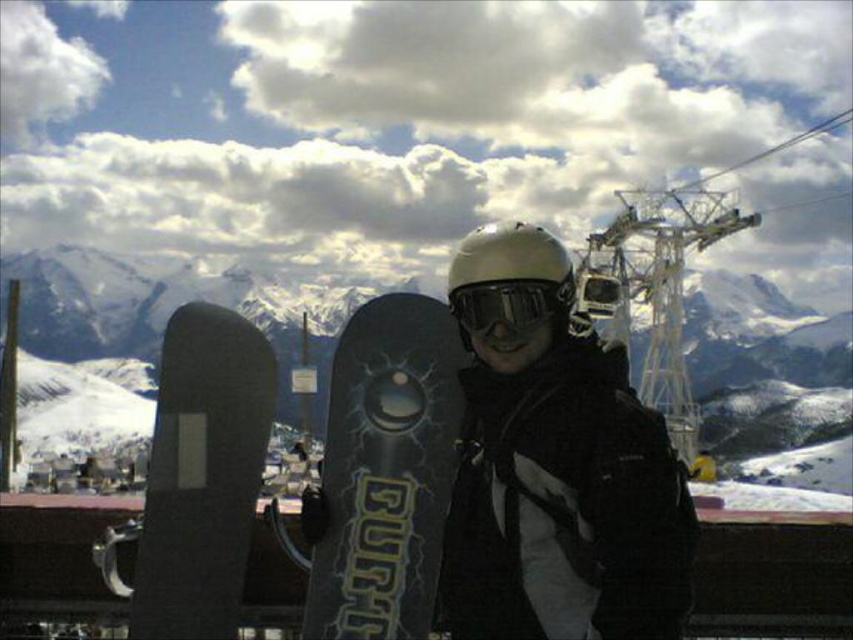
Question: From the image, what is the correct spatial relationship of snowy mountain at center in relation to glossy plastic goggles at center?

Choices:
 (A) left
 (B) right

Answer: (A)

Question: Among these points, which one is nearest to the camera?

Choices:
 (A) (766, 438)
 (B) (422, 378)
 (C) (173, 509)

Answer: (C)

Question: Estimate the real-world distances between objects in this image. Which object is closer to the black matte snowboard at left?

Choices:
 (A) black matte snowboard at center
 (B) white matte helmet at center
 (C) glossy plastic goggles at center
 (D) snowy mountain at center

Answer: (A)

Question: In this image, where is snowy mountain at center located relative to black matte snowboard at center?

Choices:
 (A) above
 (B) below

Answer: (A)

Question: Which of the following is the farthest from the observer?

Choices:
 (A) glossy plastic goggles at center
 (B) snowy mountain at center
 (C) black matte snowboard at left
 (D) black matte snowboard at center

Answer: (B)

Question: Can you confirm if black matte snowboard at center is wider than white matte helmet at center?

Choices:
 (A) yes
 (B) no

Answer: (A)